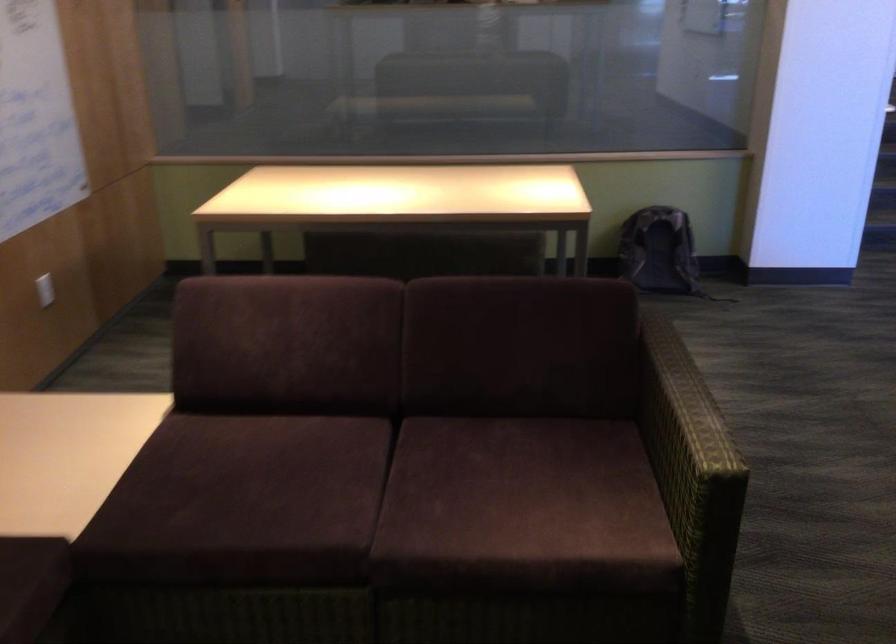
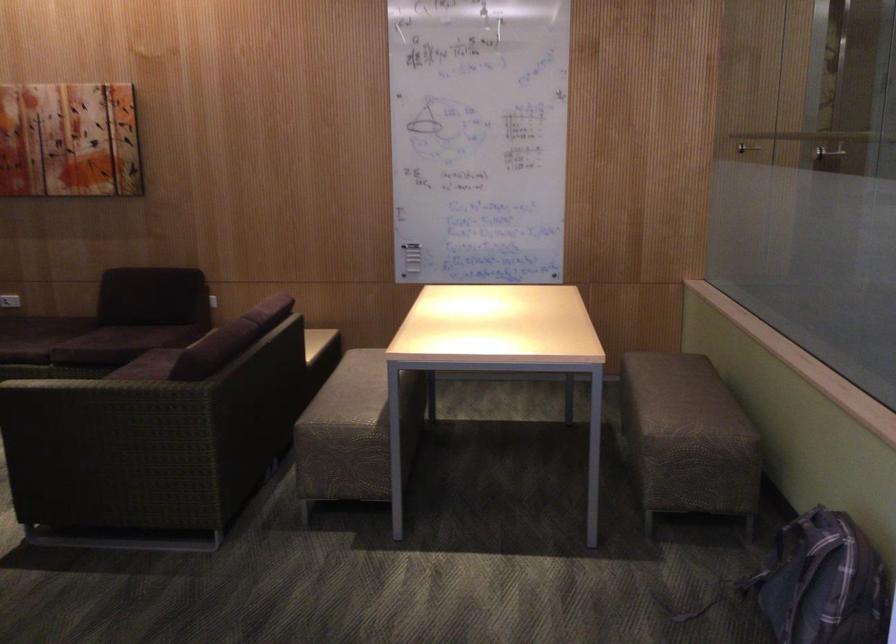
Question: I am providing you with two images of the same scene from different viewpoints. Please identify which objects are invisible in image2.

Choices:
 (A) metal partition handle
 (B) purple sofa sitting surface
 (C) red Coca-Cola can
 (D) sofa sitting surface

Answer: (D)